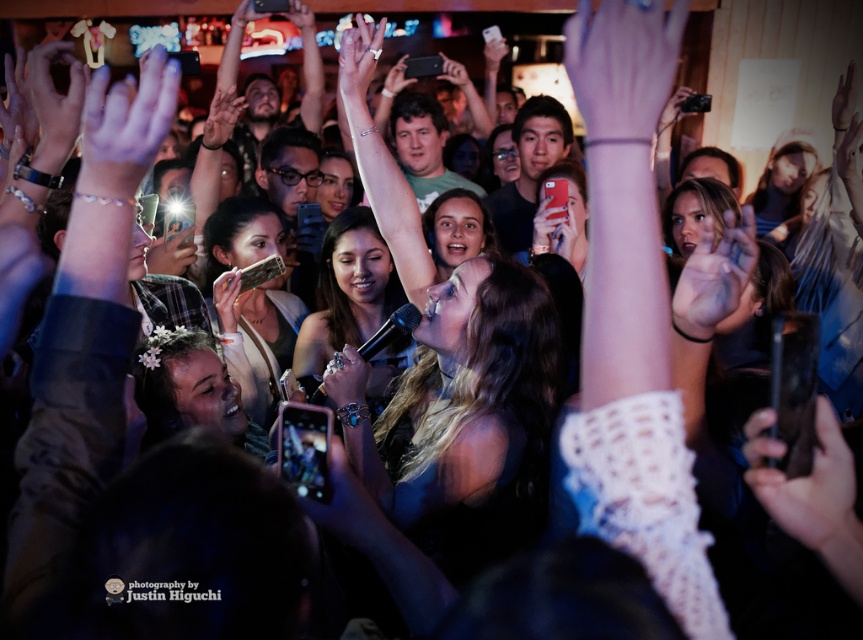
Question: Is matte silver ring at center above matte black phone at center?

Choices:
 (A) no
 (B) yes

Answer: (A)

Question: Does transparent skin at center appear over matte silver ring at upper center?

Choices:
 (A) yes
 (B) no

Answer: (B)

Question: Which point is closer to the camera taking this photo?

Choices:
 (A) (224, 282)
 (B) (683, 4)

Answer: (B)

Question: Which of these objects is positioned farthest from the white knitted glove at upper center?

Choices:
 (A) matte black phone at center
 (B) matte black hand at upper center

Answer: (B)

Question: Does white lace glove at upper left have a larger size compared to matte silver ring at upper center?

Choices:
 (A) no
 (B) yes

Answer: (A)

Question: Which object appears closest to the camera in this image?

Choices:
 (A) matte silver ring at upper center
 (B) white knitted glove at upper center
 (C) transparent skin at center

Answer: (B)